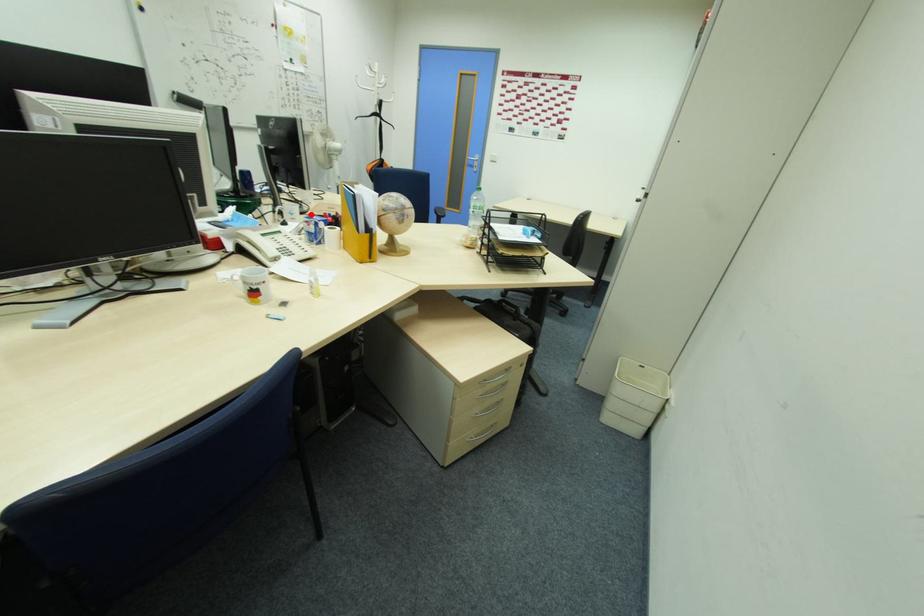
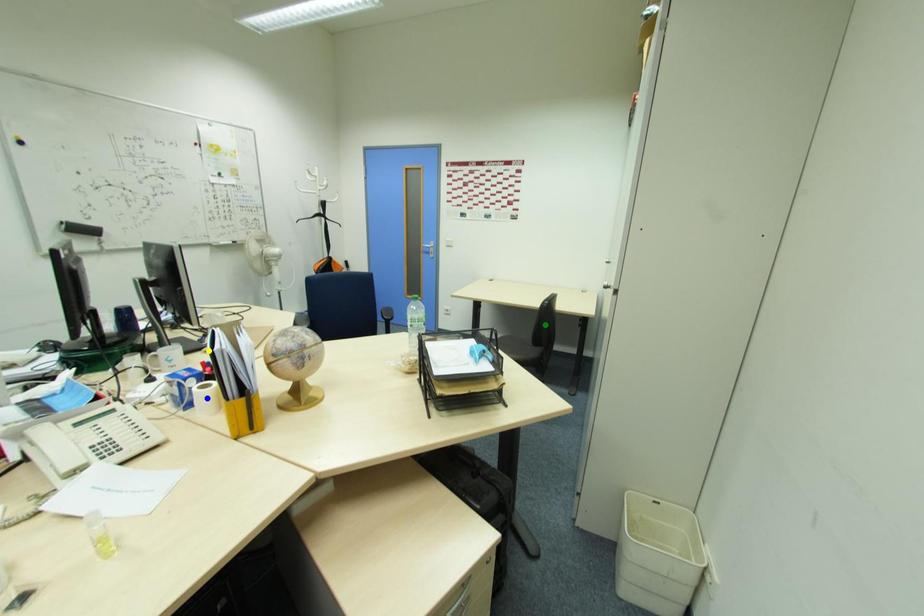
Question: I am providing you with two images of the same scene from different viewpoints. A red point is marked on the first image. You are given multiple points on the second image. Which mark in image 2 goes with the point in image 1?

Choices:
 (A) blue point
 (B) yellow point
 (C) green point

Answer: (B)